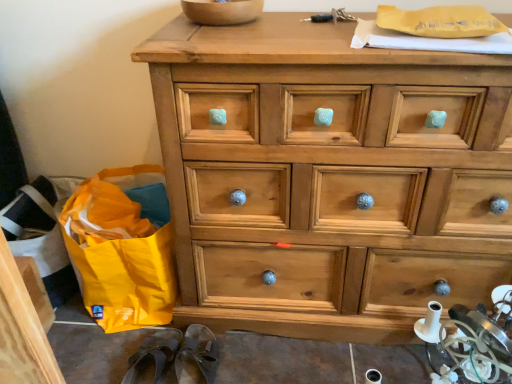
This screenshot has height=384, width=512. What do you see at coordinates (122, 247) in the screenshot? I see `yellow fabric bag at lower left` at bounding box center [122, 247].

The height and width of the screenshot is (384, 512). Describe the element at coordinates (329, 177) in the screenshot. I see `natural wood chest of drawers at center` at that location.

Describe the element at coordinates (153, 357) in the screenshot. I see `brown leather slipper at lower left, the first slipper in the left-to-right sequence` at that location.

How much space does brown leather slipper at lower left, the second slipper in the right-to-left sequence, occupy vertically?

3.50 inches.

Where is `brown leather slipper at lower center, which ranks as the 2th slipper in left-to-right order`? This screenshot has width=512, height=384. brown leather slipper at lower center, which ranks as the 2th slipper in left-to-right order is located at coordinates (197, 356).

From the picture: From a real-world perspective, relative to wooden bowl at upper center, is brown leather slipper at lower left, the second slipper in the right-to-left sequence, vertically above or below?

brown leather slipper at lower left, the second slipper in the right-to-left sequence, is below wooden bowl at upper center.

Considering the positions of objects brown leather slipper at lower left, the second slipper in the right-to-left sequence, and wooden bowl at upper center in the image provided, who is in front, brown leather slipper at lower left, the second slipper in the right-to-left sequence, or wooden bowl at upper center?

wooden bowl at upper center is in front.

Is point (154, 338) closer to camera compared to point (210, 16)?

That is False.

In terms of height, does brown leather slipper at lower left, the first slipper in the left-to-right sequence, look taller or shorter compared to wooden bowl at upper center?

Considering their sizes, brown leather slipper at lower left, the first slipper in the left-to-right sequence, has more height than wooden bowl at upper center.

There is a wooden bowl at upper center. Where is `the 2nd slipper below it (from a real-world perspective)`? This screenshot has width=512, height=384. the 2nd slipper below it (from a real-world perspective) is located at coordinates (197, 356).

Based on their positions, is brown leather slipper at lower center, which ranks as the 2th slipper in left-to-right order, located to the left or right of wooden bowl at upper center?

brown leather slipper at lower center, which ranks as the 2th slipper in left-to-right order, is to the left of wooden bowl at upper center.

From the image's perspective, is brown leather slipper at lower center, which ranks as the 2th slipper in left-to-right order, over wooden bowl at upper center?

No, from the image's perspective, brown leather slipper at lower center, which ranks as the 2th slipper in left-to-right order, is not on top of wooden bowl at upper center.

Measure the distance between wooden bowl at upper center and yellow fabric bag at lower left.

A distance of 68.69 centimeters exists between wooden bowl at upper center and yellow fabric bag at lower left.

Considering the relative sizes of wooden bowl at upper center and yellow fabric bag at lower left in the image provided, is wooden bowl at upper center thinner than yellow fabric bag at lower left?

Correct, the width of wooden bowl at upper center is less than that of yellow fabric bag at lower left.

Which point is more forward, (216, 6) or (122, 178)?

The point (216, 6) is in front.

Which of these two, yellow fabric bag at lower left or brown leather slipper at lower left, the second slipper in the right-to-left sequence, is bigger?

With larger size is yellow fabric bag at lower left.

Considering the relative positions of yellow fabric bag at lower left and brown leather slipper at lower left, the first slipper in the left-to-right sequence, in the image provided, is yellow fabric bag at lower left to the right of brown leather slipper at lower left, the first slipper in the left-to-right sequence, from the viewer's perspective?

In fact, yellow fabric bag at lower left is to the left of brown leather slipper at lower left, the first slipper in the left-to-right sequence.

From the image's perspective, which slipper is the 1st one below the yellow fabric bag at lower left? Please provide its 2D coordinates.

[(153, 357)]

Does natural wood chest of drawers at center contain yellow fabric bag at lower left?

Actually, yellow fabric bag at lower left is outside natural wood chest of drawers at center.

Between natural wood chest of drawers at center and yellow fabric bag at lower left, which one has more height?

natural wood chest of drawers at center is taller.

Can you confirm if natural wood chest of drawers at center is smaller than yellow fabric bag at lower left?

No, natural wood chest of drawers at center is not smaller than yellow fabric bag at lower left.

Is point (284, 198) positioned behind point (189, 369)?

No.

Considering the relative sizes of natural wood chest of drawers at center and brown leather slipper at lower center, which ranks as the 2th slipper in left-to-right order, in the image provided, is natural wood chest of drawers at center smaller than brown leather slipper at lower center, which ranks as the 2th slipper in left-to-right order,?

No, natural wood chest of drawers at center is not smaller than brown leather slipper at lower center, which ranks as the 2th slipper in left-to-right order.

Between natural wood chest of drawers at center and brown leather slipper at lower center, which ranks as the 2th slipper in left-to-right order, which one is positioned behind?

brown leather slipper at lower center, which ranks as the 2th slipper in left-to-right order, is further from the camera.

Is natural wood chest of drawers at center placed right next to brown leather slipper at lower left, the second slipper in the right-to-left sequence?

No, natural wood chest of drawers at center is not next to brown leather slipper at lower left, the second slipper in the right-to-left sequence.

Is the depth of natural wood chest of drawers at center greater than that of brown leather slipper at lower left, the first slipper in the left-to-right sequence?

No, natural wood chest of drawers at center is closer to the camera.

Can we say natural wood chest of drawers at center lies outside brown leather slipper at lower left, the first slipper in the left-to-right sequence?

natural wood chest of drawers at center lies outside brown leather slipper at lower left, the first slipper in the left-to-right sequence,'s area.

Is brown leather slipper at lower left, the second slipper in the right-to-left sequence, at the back of natural wood chest of drawers at center?

No.

From a real-world perspective, count 1st slippers downward from the wooden bowl at upper center and point to it. Please provide its 2D coordinates.

[(153, 357)]

Where is `bowl above the brown leather slipper at lower center, acting as the first slipper starting from the right (from the image's perspective)`? The image size is (512, 384). bowl above the brown leather slipper at lower center, acting as the first slipper starting from the right (from the image's perspective) is located at coordinates (222, 11).

When comparing their distances from wooden bowl at upper center, does brown leather slipper at lower left, the second slipper in the right-to-left sequence, or natural wood chest of drawers at center seem further?

The object further to wooden bowl at upper center is brown leather slipper at lower left, the second slipper in the right-to-left sequence.

When comparing their distances from brown leather slipper at lower center, which ranks as the 2th slipper in left-to-right order, does wooden bowl at upper center or natural wood chest of drawers at center seem closer?

natural wood chest of drawers at center is positioned closer to the anchor brown leather slipper at lower center, which ranks as the 2th slipper in left-to-right order.

In the scene shown: Estimate the real-world distances between objects in this image. Which object is closer to yellow fabric bag at lower left, brown leather slipper at lower center, which ranks as the 2th slipper in left-to-right order, or brown leather slipper at lower left, the second slipper in the right-to-left sequence?

Based on the image, brown leather slipper at lower left, the second slipper in the right-to-left sequence, appears to be nearer to yellow fabric bag at lower left.

In the scene shown: Estimate the real-world distances between objects in this image. Which object is closer to yellow fabric bag at lower left, natural wood chest of drawers at center or brown leather slipper at lower center, which ranks as the 2th slipper in left-to-right order?

brown leather slipper at lower center, which ranks as the 2th slipper in left-to-right order, is closer to yellow fabric bag at lower left.

Estimate the real-world distances between objects in this image. Which object is closer to brown leather slipper at lower left, the first slipper in the left-to-right sequence, yellow fabric bag at lower left or brown leather slipper at lower center, acting as the first slipper starting from the right?

Based on the image, brown leather slipper at lower center, acting as the first slipper starting from the right, appears to be nearer to brown leather slipper at lower left, the first slipper in the left-to-right sequence.

When comparing their distances from brown leather slipper at lower center, which ranks as the 2th slipper in left-to-right order, does brown leather slipper at lower left, the first slipper in the left-to-right sequence, or yellow fabric bag at lower left seem closer?

brown leather slipper at lower left, the first slipper in the left-to-right sequence.

Looking at the image, which one is located further to wooden bowl at upper center, brown leather slipper at lower left, the second slipper in the right-to-left sequence, or yellow fabric bag at lower left?

brown leather slipper at lower left, the second slipper in the right-to-left sequence, lies further to wooden bowl at upper center than the other object.

When comparing their distances from brown leather slipper at lower center, which ranks as the 2th slipper in left-to-right order, does natural wood chest of drawers at center or yellow fabric bag at lower left seem closer?

yellow fabric bag at lower left is closer to brown leather slipper at lower center, which ranks as the 2th slipper in left-to-right order.

The height and width of the screenshot is (384, 512). I want to click on chest of drawers between wooden bowl at upper center and brown leather slipper at lower center, which ranks as the 2th slipper in left-to-right order, from top to bottom, so click(329, 177).

Locate an element on the screen. This screenshot has height=384, width=512. bowl between yellow fabric bag at lower left and natural wood chest of drawers at center from left to right is located at coordinates (222, 11).

The width and height of the screenshot is (512, 384). Identify the location of slipper located between brown leather slipper at lower left, the second slipper in the right-to-left sequence, and natural wood chest of drawers at center in the left-right direction. (197, 356).

Image resolution: width=512 pixels, height=384 pixels. I want to click on slipper between yellow fabric bag at lower left and brown leather slipper at lower center, which ranks as the 2th slipper in left-to-right order, from top to bottom, so click(x=153, y=357).